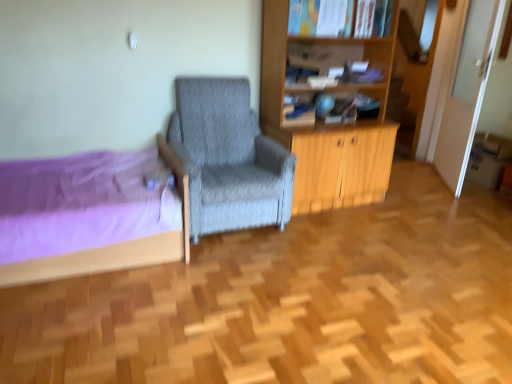
Question: Which direction should I rotate to look at hardcover book at upper center, which is the 2th book from left to right, — up or down?

Choices:
 (A) up
 (B) down

Answer: (A)

Question: Considering the relative sizes of purple fabric bed at left and hardcover book at upper center, the 1th book from the top, in the image provided, is purple fabric bed at left smaller than hardcover book at upper center, the 1th book from the top,?

Choices:
 (A) yes
 (B) no

Answer: (B)

Question: From the image's perspective, would you say purple fabric bed at left is positioned over hardcover book at upper center, the 2th book from the bottom?

Choices:
 (A) no
 (B) yes

Answer: (A)

Question: Is purple fabric bed at left placed right next to hardcover book at upper center, the 1th book from the top?

Choices:
 (A) yes
 (B) no

Answer: (B)

Question: Does purple fabric bed at left appear on the left side of hardcover book at upper center, which is the 2th book from left to right?

Choices:
 (A) no
 (B) yes

Answer: (B)

Question: Could you tell me if purple fabric bed at left is turned towards hardcover book at upper center, which ranks as the first book in right-to-left order?

Choices:
 (A) yes
 (B) no

Answer: (B)

Question: Can you confirm if purple fabric bed at left is shorter than hardcover book at upper center, which is the 2th book from left to right?

Choices:
 (A) yes
 (B) no

Answer: (B)

Question: Is hardcover book at upper center, which ranks as the first book in right-to-left order, at the left side of gray fabric chair at center?

Choices:
 (A) no
 (B) yes

Answer: (A)

Question: From a real-world perspective, is hardcover book at upper center, which is the 2th book from left to right, positioned over gray fabric chair at center based on gravity?

Choices:
 (A) no
 (B) yes

Answer: (B)

Question: From the image's perspective, is hardcover book at upper center, which ranks as the first book in right-to-left order, on gray fabric chair at center?

Choices:
 (A) yes
 (B) no

Answer: (A)

Question: Is hardcover book at upper center, the 1th book from the top, to the right of gray fabric chair at center from the viewer's perspective?

Choices:
 (A) no
 (B) yes

Answer: (B)

Question: Considering the relative sizes of hardcover book at upper center, which is the 2th book from left to right, and gray fabric chair at center in the image provided, is hardcover book at upper center, which is the 2th book from left to right, shorter than gray fabric chair at center?

Choices:
 (A) no
 (B) yes

Answer: (B)

Question: From a real-world perspective, is hardcover book at upper center, the 2th book from the bottom, below gray fabric chair at center?

Choices:
 (A) yes
 (B) no

Answer: (B)

Question: Can you confirm if matte blue book at upper center, which is the 1th book in bottom-to-top order, is wider than hardcover book at upper center, which is the 2th book from left to right?

Choices:
 (A) yes
 (B) no

Answer: (B)